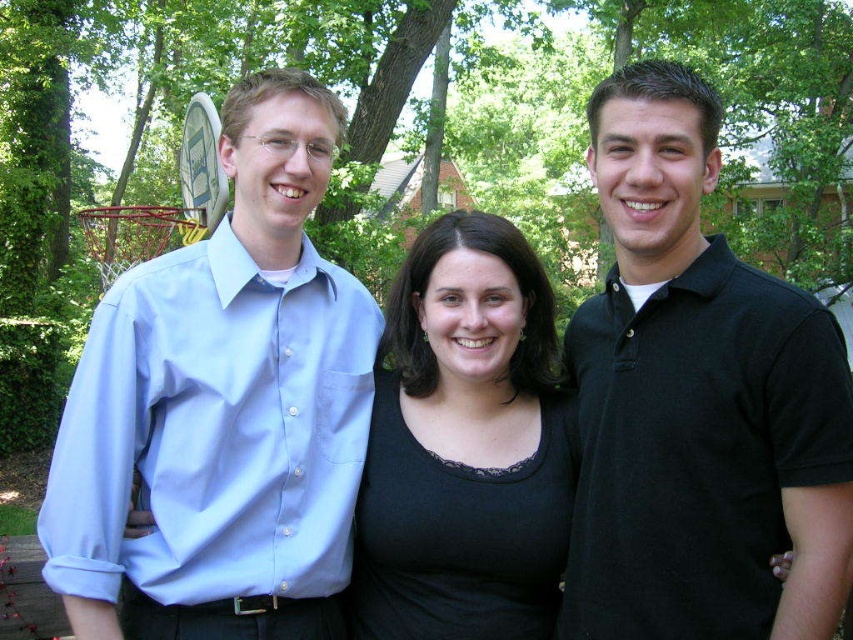
Does black polo shirt at right appear under black matte shirt at center?

Incorrect, black polo shirt at right is not positioned below black matte shirt at center.

Does black polo shirt at right have a lesser height compared to black matte shirt at center?

In fact, black polo shirt at right may be taller than black matte shirt at center.

Is point (676, 332) more distant than point (505, 545)?

No, (676, 332) is closer to viewer.

Locate an element on the screen. The image size is (853, 640). black polo shirt at right is located at coordinates (698, 403).

Does light blue cotton shirt at left have a smaller size compared to black matte shirt at center?

No, light blue cotton shirt at left is not smaller than black matte shirt at center.

From the picture: Who is more forward, (107, 314) or (462, 252)?

Positioned in front is point (107, 314).

This screenshot has height=640, width=853. I want to click on light blue cotton shirt at left, so click(x=222, y=406).

Does point (306, 506) lie behind point (706, 273)?

Yes, it is.

What do you see at coordinates (222, 406) in the screenshot? I see `light blue cotton shirt at left` at bounding box center [222, 406].

Who is more forward, [292,355] or [688,442]?

Point [688,442]

Image resolution: width=853 pixels, height=640 pixels. Find the location of `light blue cotton shirt at left`. light blue cotton shirt at left is located at coordinates (222, 406).